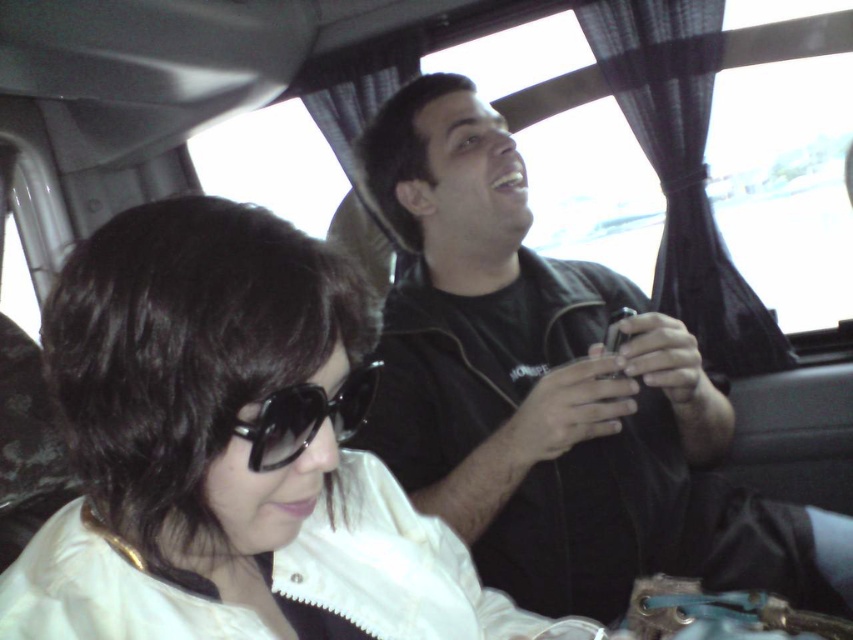
Question: Which point is closer to the camera?

Choices:
 (A) (312, 394)
 (B) (427, 129)

Answer: (A)

Question: Is black matte shirt at center to the left of black plastic sunglasses at center from the viewer's perspective?

Choices:
 (A) yes
 (B) no

Answer: (B)

Question: Does black matte shirt at center appear on the left side of black plastic sunglasses at center?

Choices:
 (A) no
 (B) yes

Answer: (A)

Question: Is black matte shirt at center thinner than black plastic sunglasses at center?

Choices:
 (A) yes
 (B) no

Answer: (B)

Question: Which of the following is the farthest from the observer?

Choices:
 (A) (296, 412)
 (B) (827, 572)

Answer: (B)